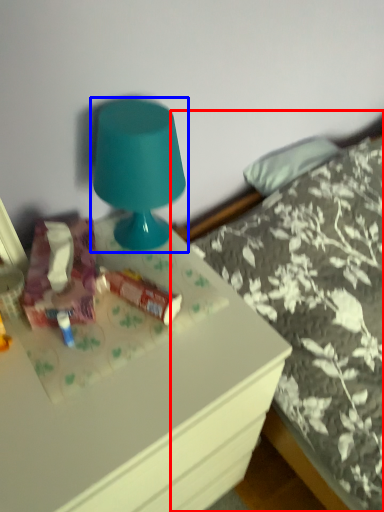
Question: Which object is closer to the camera taking this photo, bed (highlighted by a red box) or lamp (highlighted by a blue box)?

Choices:
 (A) bed
 (B) lamp

Answer: (A)